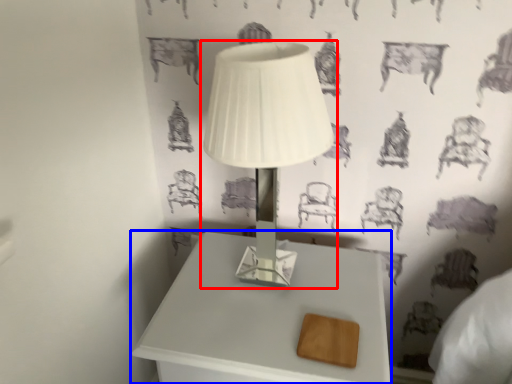
Question: Which of the following is the farthest to the observer, lamp (highlighted by a red box) or table (highlighted by a blue box)?

Choices:
 (A) lamp
 (B) table

Answer: (B)